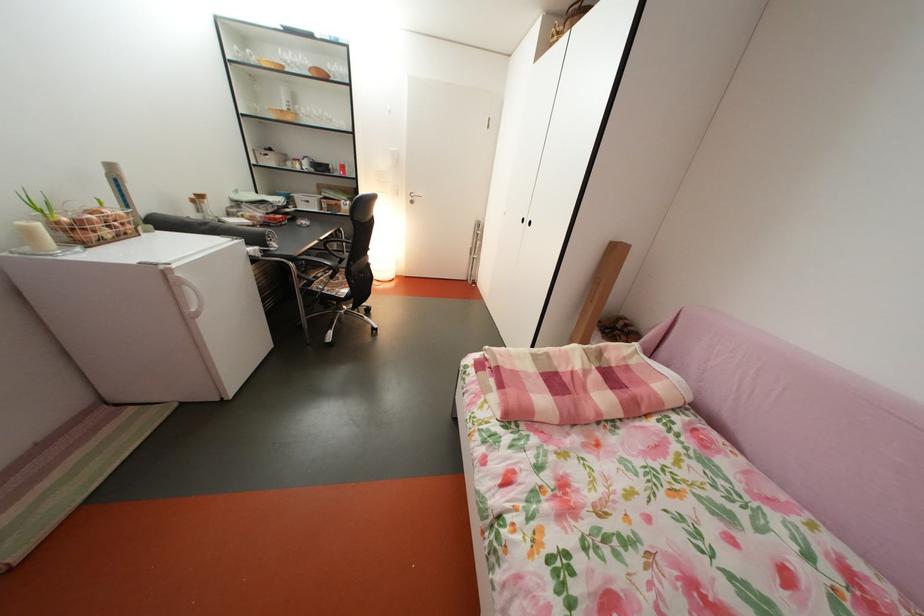
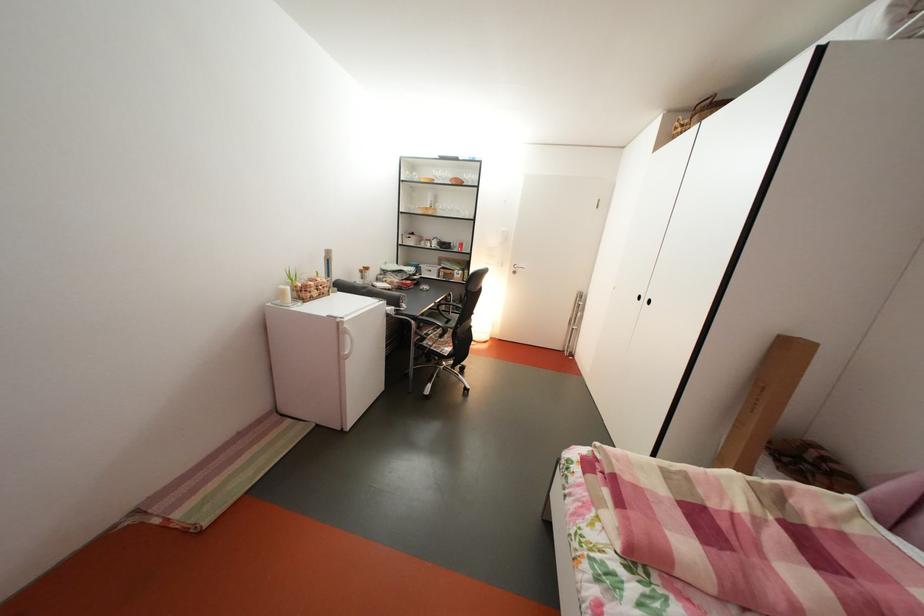
Question: The first image is from the beginning of the video and the second image is from the end. How did the camera likely rotate when shooting the video?

Choices:
 (A) Left
 (B) Right
 (C) Up
 (D) Down

Answer: (A)